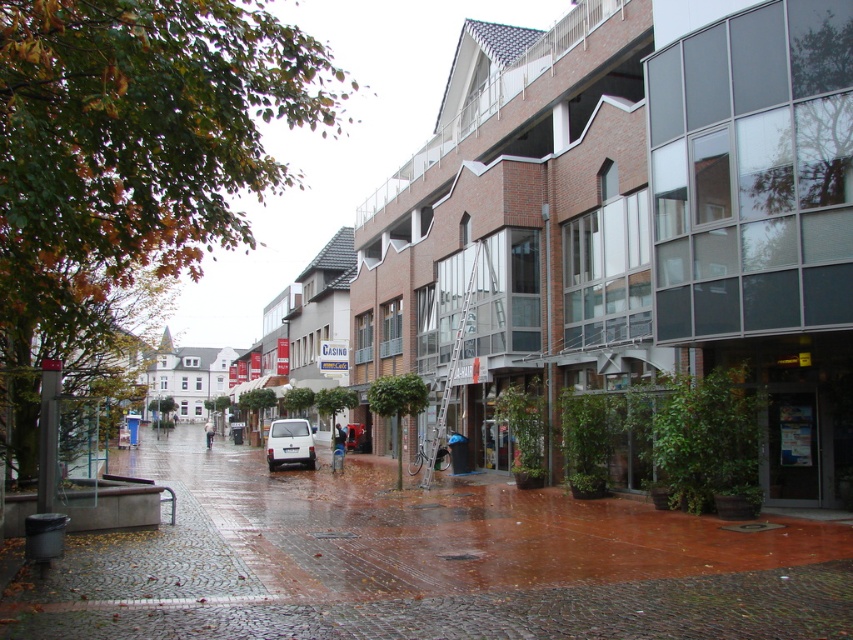
What do you see at coordinates (422, 563) in the screenshot?
I see `brick pavement at center` at bounding box center [422, 563].

Is point (102, 557) positioned before point (274, 467)?

Yes, it is.

Does point (555, 592) lie in front of point (308, 456)?

Yes.

Find the location of a particular element. brick pavement at center is located at coordinates (422, 563).